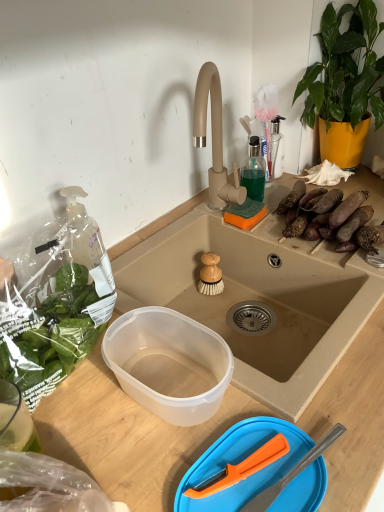
Question: From the image's perspective, is transparent plastic container at center on green leafy plant at upper right?

Choices:
 (A) no
 (B) yes

Answer: (A)

Question: Would you say transparent plastic container at center is outside green leafy plant at upper right?

Choices:
 (A) no
 (B) yes

Answer: (B)

Question: Considering the relative positions of transparent plastic container at center and green leafy plant at upper right in the image provided, is transparent plastic container at center to the left of green leafy plant at upper right from the viewer's perspective?

Choices:
 (A) yes
 (B) no

Answer: (A)

Question: Are transparent plastic container at center and green leafy plant at upper right far apart?

Choices:
 (A) no
 (B) yes

Answer: (A)

Question: Is transparent plastic container at center positioned before green leafy plant at upper right?

Choices:
 (A) no
 (B) yes

Answer: (B)

Question: Does transparent plastic container at center contain green leafy plant at upper right?

Choices:
 (A) no
 (B) yes

Answer: (A)

Question: Is green leafy plant at upper right to the left of wooden-bristled brush at sink center from the viewer's perspective?

Choices:
 (A) no
 (B) yes

Answer: (A)

Question: From a real-world perspective, is green leafy plant at upper right positioned under wooden-bristled brush at sink center based on gravity?

Choices:
 (A) yes
 (B) no

Answer: (B)

Question: Is green leafy plant at upper right not within wooden-bristled brush at sink center?

Choices:
 (A) yes
 (B) no

Answer: (A)

Question: From the image's perspective, would you say green leafy plant at upper right is positioned over wooden-bristled brush at sink center?

Choices:
 (A) yes
 (B) no

Answer: (A)

Question: Does green leafy plant at upper right touch wooden-bristled brush at sink center?

Choices:
 (A) no
 (B) yes

Answer: (A)

Question: Does green leafy plant at upper right have a greater width compared to wooden-bristled brush at sink center?

Choices:
 (A) yes
 (B) no

Answer: (A)

Question: Considering the relative positions of transparent plastic bowl at lower center and wooden-bristled brush at sink center in the image provided, is transparent plastic bowl at lower center to the left of wooden-bristled brush at sink center from the viewer's perspective?

Choices:
 (A) no
 (B) yes

Answer: (B)